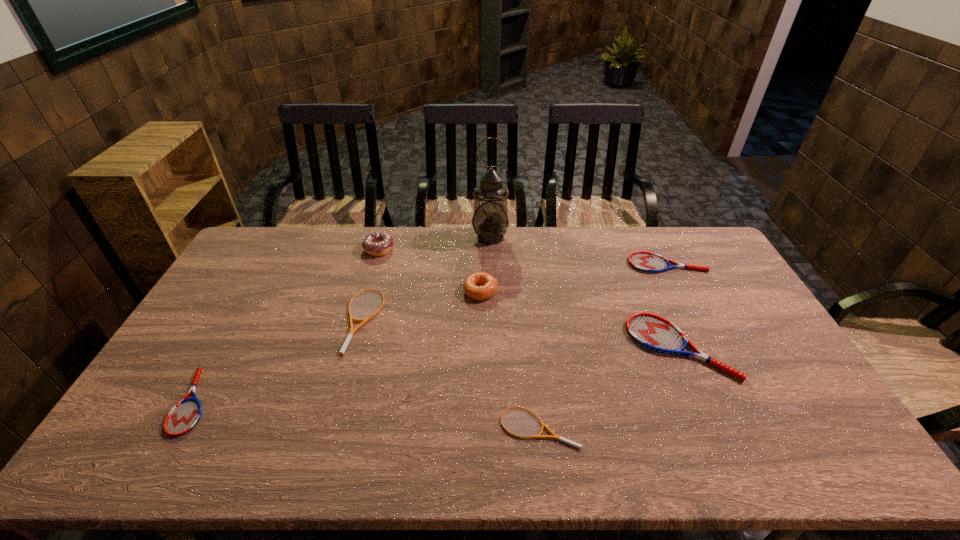
Where is `the left beige tennis racket`? The width and height of the screenshot is (960, 540). the left beige tennis racket is located at coordinates (350, 335).

What are the coordinates of `the leftmost tennis racket` in the screenshot? It's located at (184, 416).

The image size is (960, 540). Identify the location of the leftmost object. (184, 416).

Locate an element on the screen. the right beige tennis racket is located at coordinates (554, 436).

In order to click on the smaller beige tennis racket in this screenshot , I will do `click(554, 436)`.

Find the location of `vacant space located 0.400m on the left of the oil lamp`. vacant space located 0.400m on the left of the oil lamp is located at coordinates (370, 237).

The image size is (960, 540). Identify the location of free space located on the right of the farther doughnut. (480, 249).

Locate an element on the screen. The width and height of the screenshot is (960, 540). free space located on the right of the nearer doughnut is located at coordinates (561, 291).

Locate an element on the screen. vacant space located on the back of the tallest tennis racket is located at coordinates (646, 269).

Find the location of `vacant region located 0.300m on the left of the second smallest blue tennis racket`. vacant region located 0.300m on the left of the second smallest blue tennis racket is located at coordinates (545, 264).